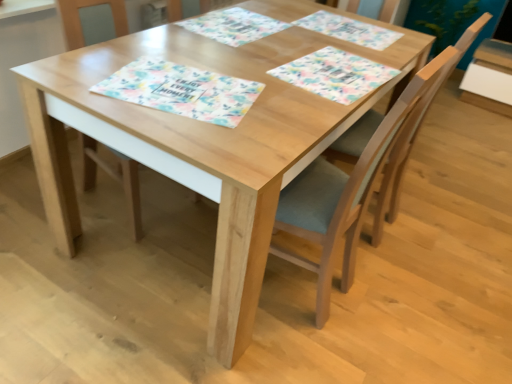
Find the location of `free space in front of floral paper placemat at upper center, marked as the 1th place mat in a back-to-front arrangement`. free space in front of floral paper placemat at upper center, marked as the 1th place mat in a back-to-front arrangement is located at coordinates pyautogui.click(x=335, y=51).